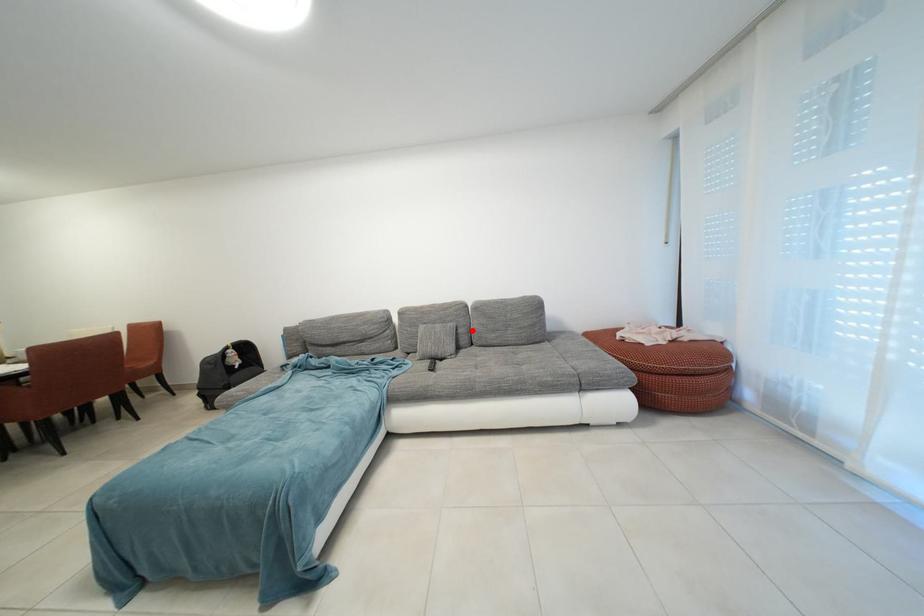
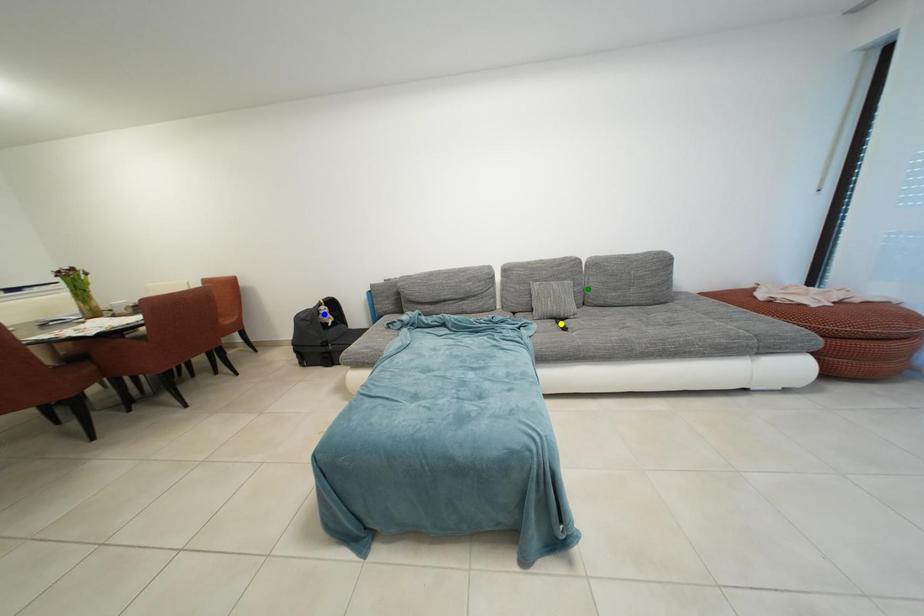
Question: I am providing you with two images of the same scene from different viewpoints. A red point is marked on the first image. You are given multiple points on the second image. In image 2, which mark is for the same physical point as the one in image 1?

Choices:
 (A) green point
 (B) blue point
 (C) yellow point

Answer: (A)